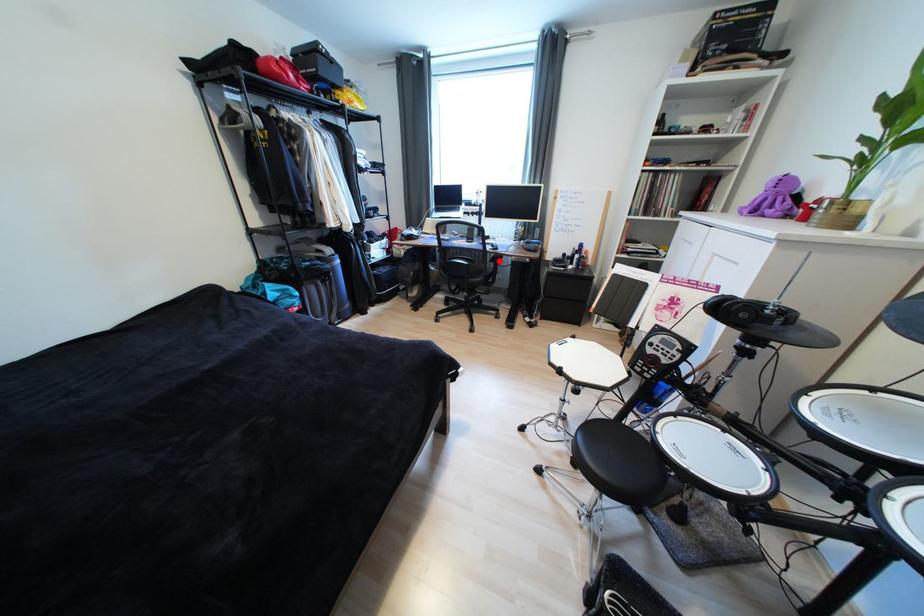
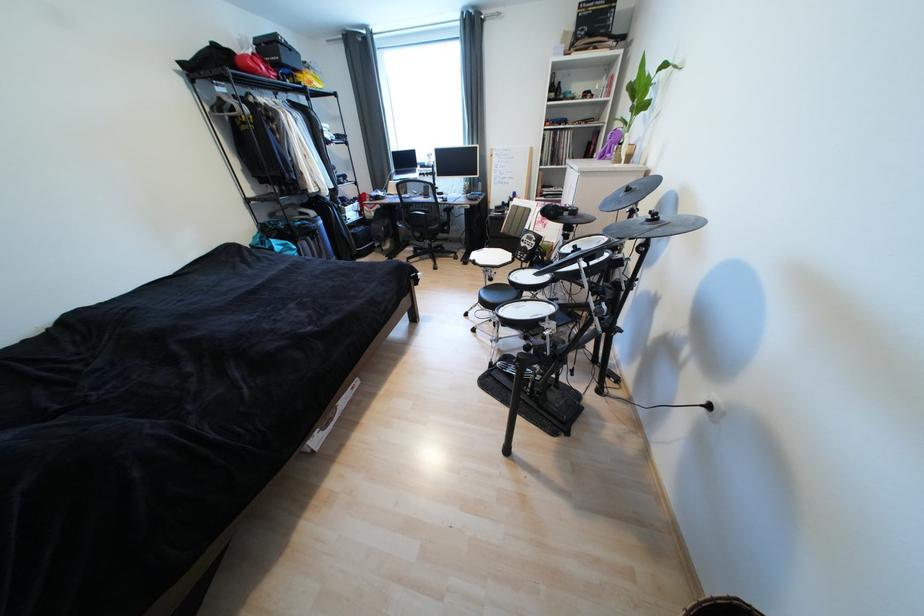
Question: A red point is marked in image1. In image2, is the corresponding 3D point closer to the camera or farther? Reply with the corresponding letter.

Choices:
 (A) The corresponding 3D point is closer.
 (B) The corresponding 3D point is farther.

Answer: (A)